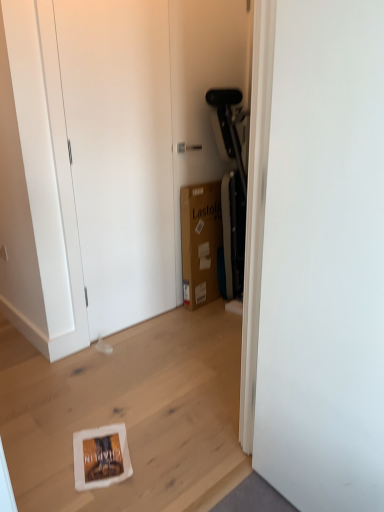
This screenshot has width=384, height=512. Identify the location of vacant area that lies in front of brown cardboard box at center. (205, 318).